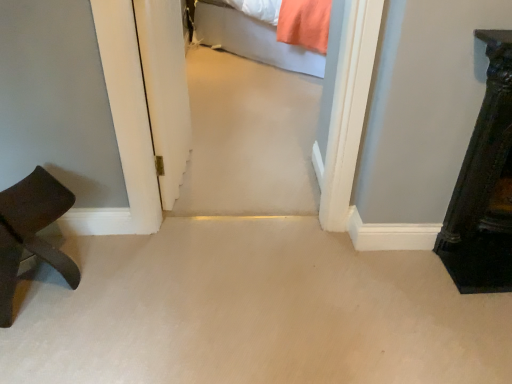
Question: In terms of size, does dark brown wood stool at left, which is counted as the 2th furniture, starting from the right, appear bigger or smaller than dark wood dresser at right, the 2th furniture viewed from the left?

Choices:
 (A) big
 (B) small

Answer: (A)

Question: Is dark brown wood stool at left, which is counted as the 2th furniture, starting from the right, to the left or to the right of dark wood dresser at right, the 2th furniture viewed from the left, in the image?

Choices:
 (A) left
 (B) right

Answer: (A)

Question: Which of these objects is positioned closest to the dark wood dresser at right, the 2th furniture viewed from the left?

Choices:
 (A) light gray fabric bed at upper center
 (B) transparent glass door at center
 (C) dark brown wood stool at left, which is counted as the 2th furniture, starting from the right

Answer: (B)

Question: Which is nearer to the transparent glass door at center?

Choices:
 (A) light gray fabric bed at upper center
 (B) dark wood dresser at right, positioned as the first furniture in right-to-left order
 (C) dark brown wood stool at left, which is counted as the 2th furniture, starting from the right

Answer: (C)